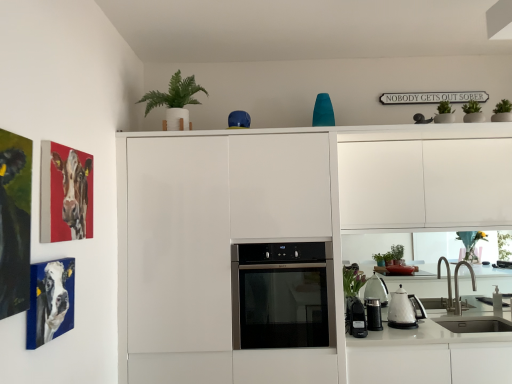
Question: In the image, is matte canvas painting of cow at upper left, which is the first picture frame from back to front, on the left side or the right side of metallic black coffee grinder at lower center, acting as the second appliance starting from the left?

Choices:
 (A) right
 (B) left

Answer: (B)

Question: From the image's perspective, relative to metallic black coffee grinder at lower center, acting as the second appliance starting from the left, is matte canvas painting of cow at upper left, placed as the third picture frame when sorted from front to back, above or below?

Choices:
 (A) above
 (B) below

Answer: (A)

Question: Based on their relative distances, which object is farther from the silver metallic faucet at lower right?

Choices:
 (A) blue glossy canvas at left, the second picture frame in the front-to-back sequence
 (B) satin black oven at center
 (C) green matte plant at upper center
 (D) metallic black coffee grinder at lower center, which is counted as the first appliance, starting from the right
 (E) matte canvas painting of cow at upper left, placed as the third picture frame when sorted from front to back

Answer: (E)

Question: Estimate the real-world distances between objects in this image. Which object is farther from the silver metallic faucet at lower right?

Choices:
 (A) white glossy kettle at lower right
 (B) black plastic power strip at lower right, which is the 2th appliance from right to left
 (C) blue glossy canvas at left, the second picture frame in the front-to-back sequence
 (D) matte canvas painting of cow at upper left, placed as the third picture frame when sorted from front to back
 (E) green matte plant at upper center

Answer: (D)